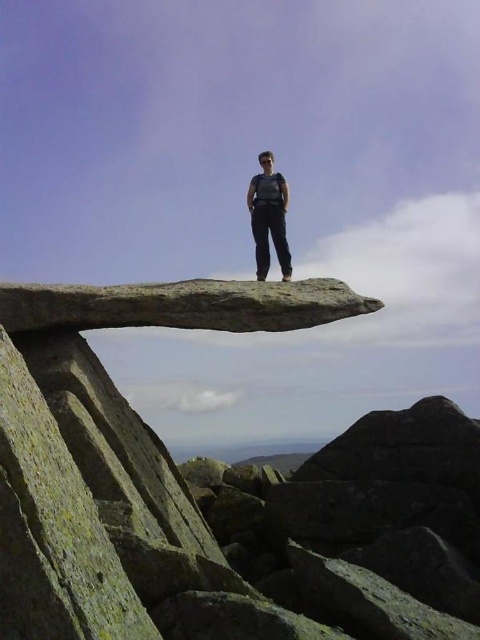
Question: Is gray rough rock at center positioned behind matte black pants at center?

Choices:
 (A) yes
 (B) no

Answer: (B)

Question: Can you confirm if gray rough rock at center is positioned to the left of matte black pants at center?

Choices:
 (A) yes
 (B) no

Answer: (A)

Question: Among these objects, which one is nearest to the camera?

Choices:
 (A) gray rough rock at center
 (B) matte black pants at center

Answer: (A)

Question: Can you confirm if gray rough rock at center is positioned to the left of matte black pants at center?

Choices:
 (A) yes
 (B) no

Answer: (A)